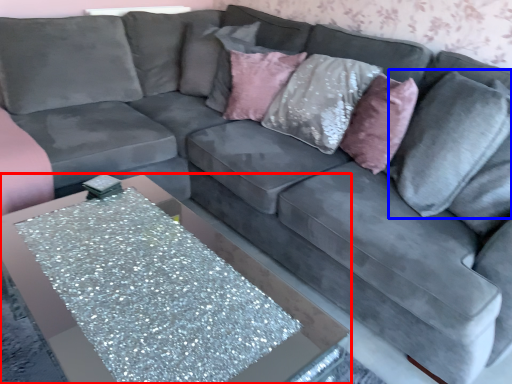
Question: Which object appears closest to the camera in this image, table (highlighted by a red box) or pillow (highlighted by a blue box)?

Choices:
 (A) table
 (B) pillow

Answer: (A)